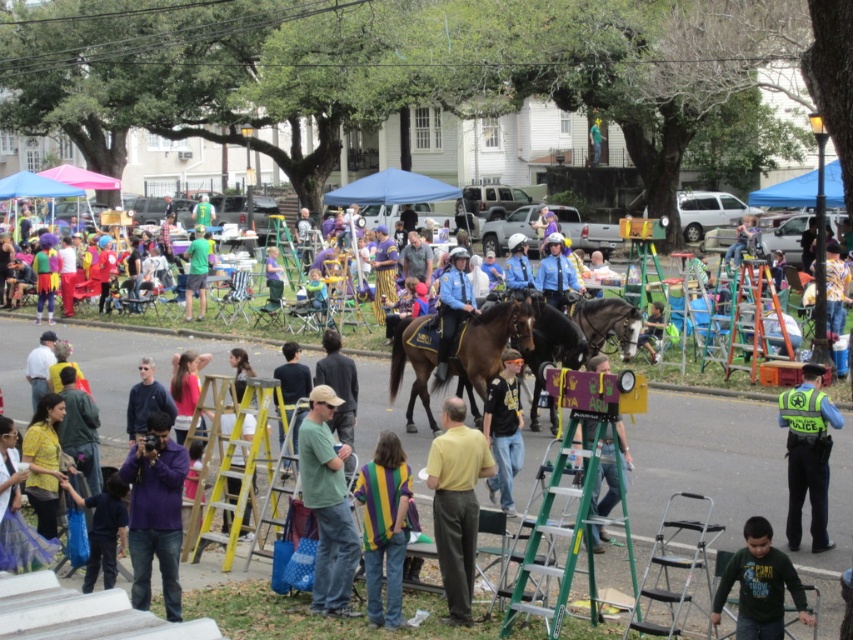
Looking at this image, you are a photographer trying to capture a shot of the shiny black horse at center and the green fabric shirt at center. If you want to frame both subjects without moving your position, which subject might require you to adjust your camera angle to include its full width?

The shiny black horse at center might be wider than green fabric shirt at center, so you might need to adjust your camera angle to include its full width.

You are a photographer at the event and want to take a clear photo of both the yellow matte shirt at center and the black leather jacket at center. Which object should you focus on first to ensure both are in focus?

The yellow matte shirt at center is taller than the black leather jacket at center. To ensure both are in focus, you should focus on the yellow matte shirt at center first, as it is the taller object and will require adjusting the focus to accommodate its height relative to the shorter black leather jacket at center.